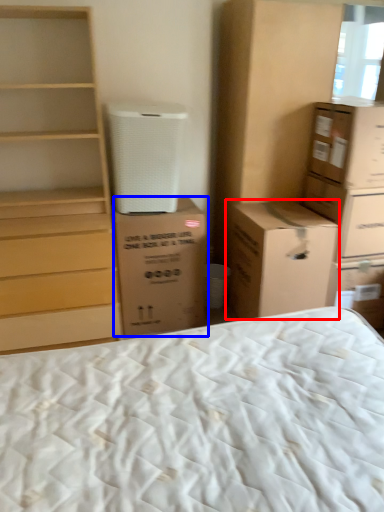
Question: Which object appears closest to the camera in this image, cardboard box (highlighted by a red box) or cardboard box (highlighted by a blue box)?

Choices:
 (A) cardboard box
 (B) cardboard box

Answer: (A)